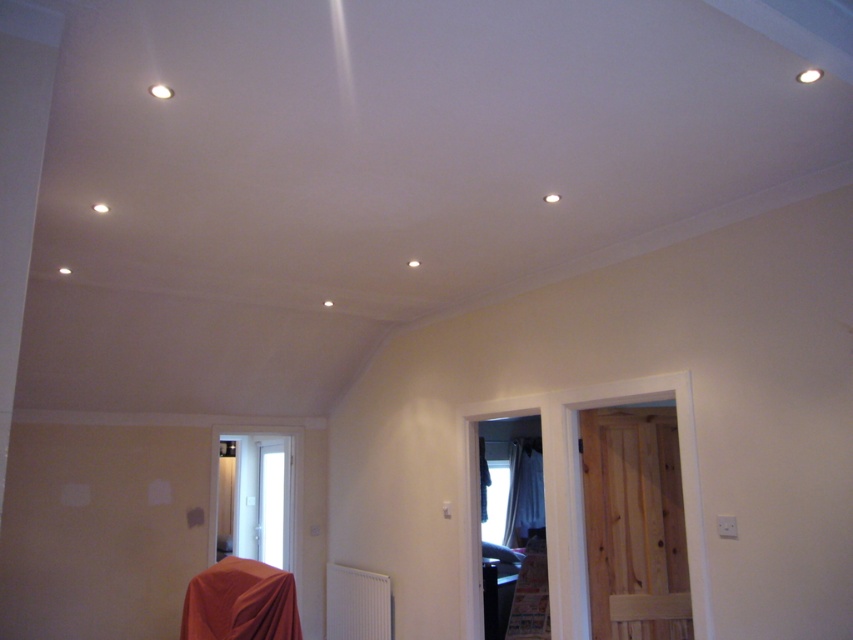
Where is `orange fabric at lower left`? orange fabric at lower left is located at coordinates (241, 602).

Is orange fabric at lower left positioned behind white sheer curtain at right?

No, orange fabric at lower left is in front of white sheer curtain at right.

Locate an element on the screen. This screenshot has height=640, width=853. orange fabric at lower left is located at coordinates (241, 602).